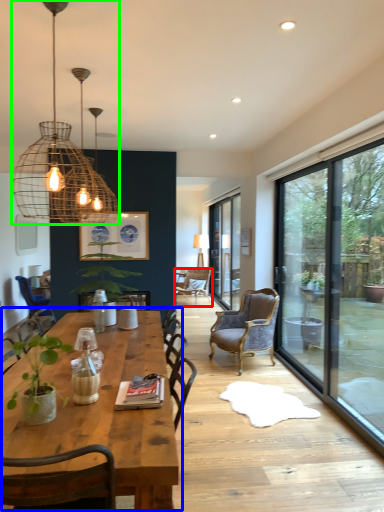
Question: Which object is positioned farthest from chair (highlighted by a red box)? Select from coffee table (highlighted by a blue box) and lamp (highlighted by a green box).

Choices:
 (A) coffee table
 (B) lamp

Answer: (B)